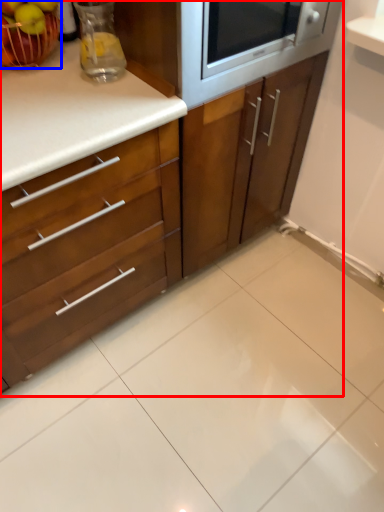
Question: Which object appears closest to the camera in this image, cabinetry (highlighted by a red box) or apple (highlighted by a blue box)?

Choices:
 (A) cabinetry
 (B) apple

Answer: (A)